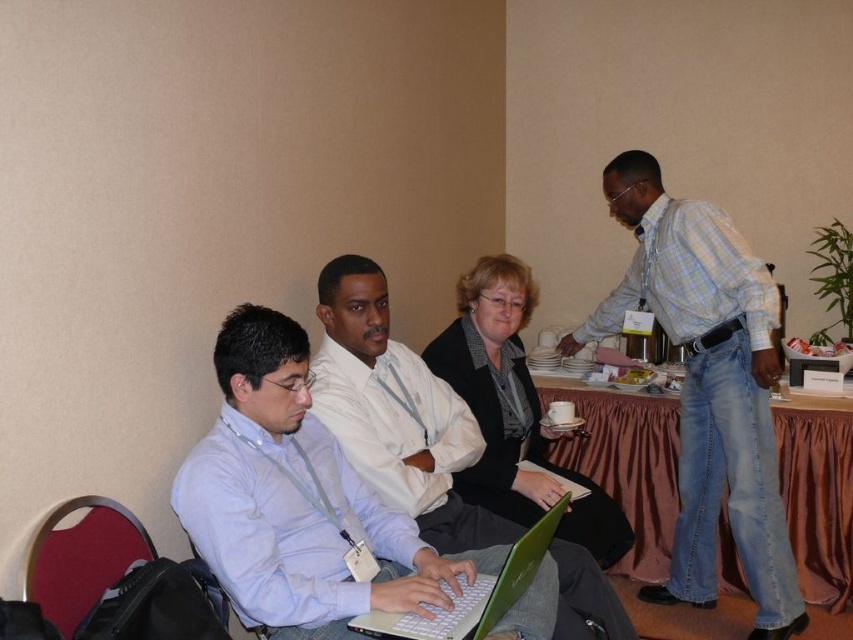
Is point (424, 595) farther from camera compared to point (492, 588)?

Yes, it is.

Locate an element on the screen. matte white shirt at center is located at coordinates (299, 500).

Identify the location of matte white shirt at center. This screenshot has width=853, height=640. (299, 500).

Is velvet red chair at lower left positioned before green matte laptop at center?

Yes, it is.

Can you confirm if velvet red chair at lower left is positioned to the right of green matte laptop at center?

Incorrect, velvet red chair at lower left is not on the right side of green matte laptop at center.

Is point (102, 506) farther from camera compared to point (428, 632)?

Yes, it is.

Locate an element on the screen. The height and width of the screenshot is (640, 853). velvet red chair at lower left is located at coordinates (80, 556).

Find the location of a particular element. The image size is (853, 640). white shirt at center is located at coordinates (396, 412).

Does white shirt at center appear under brown fabric table at center?

No.

At what (x,y) coordinates should I click in order to perform the action: click on white shirt at center. Please return your answer as a coordinate pair (x, y). This screenshot has height=640, width=853. Looking at the image, I should click on click(396, 412).